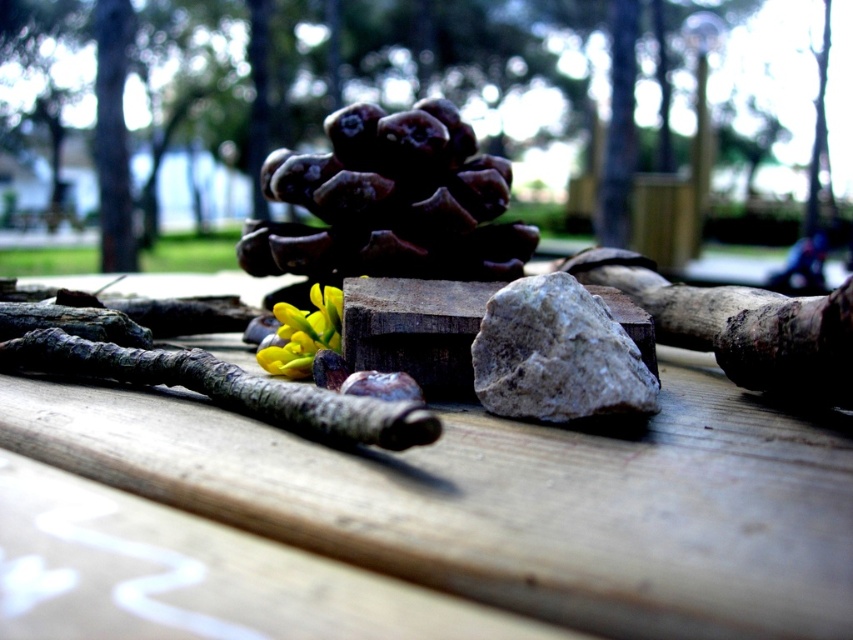
Question: Can you confirm if wooden table at center is positioned above brown rough log at center?

Choices:
 (A) yes
 (B) no

Answer: (A)

Question: Which object is positioned closest to the brown rough log at center?

Choices:
 (A) gray rough rock at center
 (B) wooden table at center

Answer: (B)

Question: Which point appears closest to the camera in this image?

Choices:
 (A) (378, 534)
 (B) (642, 400)
 (C) (218, 371)

Answer: (A)

Question: Can you confirm if wooden table at center is thinner than brown rough log at center?

Choices:
 (A) yes
 (B) no

Answer: (B)

Question: From the image, what is the correct spatial relationship of wooden table at center in relation to brown rough log at center?

Choices:
 (A) above
 (B) below

Answer: (A)

Question: Which is farther from the wooden table at center?

Choices:
 (A) gray rough rock at center
 (B) brown rough log at center

Answer: (A)